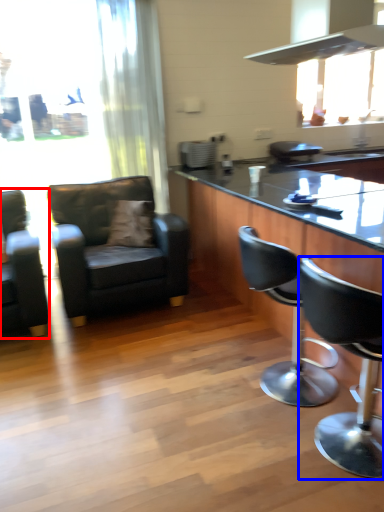
Question: Which object appears farthest to the camera in this image, chair (highlighted by a red box) or chair (highlighted by a blue box)?

Choices:
 (A) chair
 (B) chair

Answer: (A)